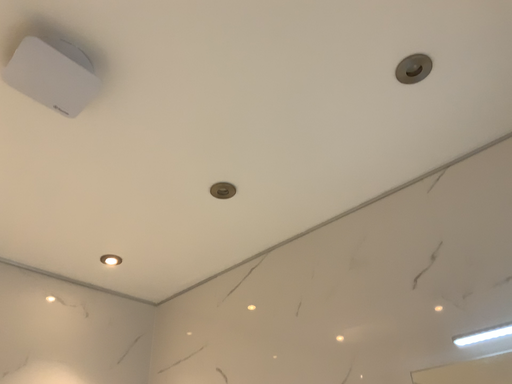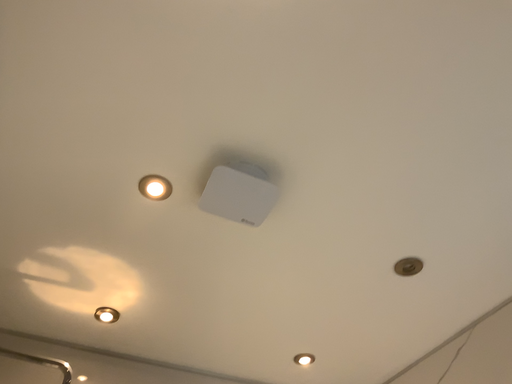
Question: Which way did the camera rotate in the video?

Choices:
 (A) rotated left
 (B) rotated right

Answer: (A)